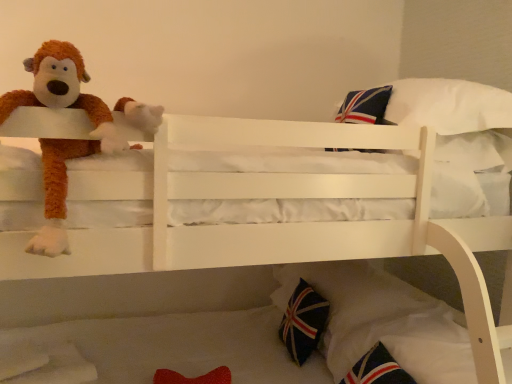
The width and height of the screenshot is (512, 384). What do you see at coordinates (303, 322) in the screenshot?
I see `dark blue fabric pillow at lower right` at bounding box center [303, 322].

Locate an element on the screen. dark blue fabric pillow at lower right is located at coordinates (303, 322).

The width and height of the screenshot is (512, 384). In order to click on fluffy brown monkey at left in this screenshot , I will do `click(61, 139)`.

The width and height of the screenshot is (512, 384). Describe the element at coordinates (61, 139) in the screenshot. I see `fluffy brown monkey at left` at that location.

Find the location of a particular element. dark blue fabric pillow at lower right is located at coordinates (303, 322).

From the picture: Can you confirm if fluffy brown monkey at left is positioned to the left of dark blue fabric pillow at lower right?

Yes.

Which object is further away from the camera, fluffy brown monkey at left or dark blue fabric pillow at lower right?

dark blue fabric pillow at lower right.

Which is less distant, (x=51, y=103) or (x=311, y=337)?

Point (x=51, y=103) appears to be closer to the viewer than point (x=311, y=337).

Consider the image. From the image's perspective, between fluffy brown monkey at left and dark blue fabric pillow at lower right, who is located below?

dark blue fabric pillow at lower right appears lower in the image.

From a real-world perspective, which is physically above, fluffy brown monkey at left or dark blue fabric pillow at lower right?

fluffy brown monkey at left is physically above.

Which object is thinner, fluffy brown monkey at left or dark blue fabric pillow at lower right?

dark blue fabric pillow at lower right.

In terms of height, does fluffy brown monkey at left look taller or shorter compared to dark blue fabric pillow at lower right?

Considering their sizes, fluffy brown monkey at left has more height than dark blue fabric pillow at lower right.

Considering the relative sizes of fluffy brown monkey at left and dark blue fabric pillow at lower right in the image provided, is fluffy brown monkey at left smaller than dark blue fabric pillow at lower right?

Actually, fluffy brown monkey at left might be larger than dark blue fabric pillow at lower right.

Do you think fluffy brown monkey at left is within dark blue fabric pillow at lower right, or outside of it?

The correct answer is: outside.

Is fluffy brown monkey at left far from dark blue fabric pillow at lower right?

Yes, fluffy brown monkey at left and dark blue fabric pillow at lower right are located far from each other.

Is fluffy brown monkey at left facing away from dark blue fabric pillow at lower right?

That's not correct — fluffy brown monkey at left is not looking away from dark blue fabric pillow at lower right.

What's the angular difference between fluffy brown monkey at left and dark blue fabric pillow at lower right's facing directions?

88.3 degrees.

Where is `throw pillow directly beneath the fluffy brown monkey at left (from a real-world perspective)`? This screenshot has height=384, width=512. throw pillow directly beneath the fluffy brown monkey at left (from a real-world perspective) is located at coordinates (303, 322).

Can you confirm if dark blue fabric pillow at lower right is positioned to the left of fluffy brown monkey at left?

Incorrect, dark blue fabric pillow at lower right is not on the left side of fluffy brown monkey at left.

Is dark blue fabric pillow at lower right behind fluffy brown monkey at left?

Yes, it is behind fluffy brown monkey at left.

Which is closer, (321, 329) or (124, 111)?

Point (321, 329) is positioned farther from the camera compared to point (124, 111).

Looking at this image, from the image's perspective, between dark blue fabric pillow at lower right and fluffy brown monkey at left, which one is located above?

fluffy brown monkey at left.

From a real-world perspective, is dark blue fabric pillow at lower right on top of fluffy brown monkey at left?

No, from a real-world perspective, dark blue fabric pillow at lower right is not over fluffy brown monkey at left

In the scene shown: Looking at their sizes, would you say dark blue fabric pillow at lower right is wider or thinner than fluffy brown monkey at left?

Clearly, dark blue fabric pillow at lower right has less width compared to fluffy brown monkey at left.

Looking at this image, considering the relative sizes of dark blue fabric pillow at lower right and fluffy brown monkey at left in the image provided, is dark blue fabric pillow at lower right shorter than fluffy brown monkey at left?

Indeed, dark blue fabric pillow at lower right has a lesser height compared to fluffy brown monkey at left.

Considering the sizes of dark blue fabric pillow at lower right and fluffy brown monkey at left in the image, is dark blue fabric pillow at lower right bigger or smaller than fluffy brown monkey at left?

Considering their sizes, dark blue fabric pillow at lower right takes up less space than fluffy brown monkey at left.

Is dark blue fabric pillow at lower right situated inside fluffy brown monkey at left or outside?

dark blue fabric pillow at lower right lies outside fluffy brown monkey at left.

Is dark blue fabric pillow at lower right with fluffy brown monkey at left?

No, dark blue fabric pillow at lower right is not in contact with fluffy brown monkey at left.

Is dark blue fabric pillow at lower right facing towards fluffy brown monkey at left?

No, dark blue fabric pillow at lower right is not aimed at fluffy brown monkey at left.

How much distance is there between dark blue fabric pillow at lower right and fluffy brown monkey at left?

dark blue fabric pillow at lower right and fluffy brown monkey at left are 1.11 meters apart from each other.

You are a GUI agent. You are given a task and a screenshot of the screen. Output one action in this format:
    pyautogui.click(x=<x>, y=<y>)
    Task: Click on the toy above the dark blue fabric pillow at lower right (from a real-world perspective)
    The width and height of the screenshot is (512, 384).
    Given the screenshot: What is the action you would take?
    pyautogui.click(x=61, y=139)

You are a GUI agent. You are given a task and a screenshot of the screen. Output one action in this format:
    pyautogui.click(x=<x>, y=<y>)
    Task: Click on the throw pillow that is on the right side of fluffy brown monkey at left
    Image resolution: width=512 pixels, height=384 pixels.
    Given the screenshot: What is the action you would take?
    pyautogui.click(x=303, y=322)

The width and height of the screenshot is (512, 384). In the image, there is a fluffy brown monkey at left. Identify the location of throw pillow below it (from a real-world perspective). click(x=303, y=322).